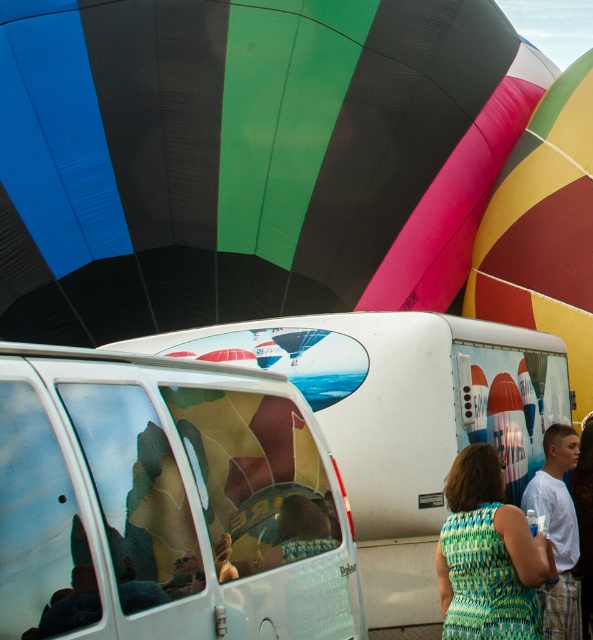
Based on the photo, can you confirm if white cotton shirt at lower right is positioned to the right of light brown hair at center?

No, white cotton shirt at lower right is not to the right of light brown hair at center.

Find the location of a particular element. The height and width of the screenshot is (640, 593). white cotton shirt at lower right is located at coordinates (557, 529).

Identify the location of white cotton shirt at lower right. (557, 529).

Which is behind, point (103, 536) or point (551, 468)?

The point (551, 468) is more distant.

Where is `white glossy minivan at center`? Image resolution: width=593 pixels, height=640 pixels. white glossy minivan at center is located at coordinates (165, 502).

Does white glossy van at center have a greater width compared to white cotton shirt at lower right?

Yes, white glossy van at center is wider than white cotton shirt at lower right.

Does white glossy van at center have a larger size compared to white cotton shirt at lower right?

Yes, white glossy van at center is bigger than white cotton shirt at lower right.

Find the location of a particular element. Image resolution: width=593 pixels, height=640 pixels. white glossy van at center is located at coordinates point(400,419).